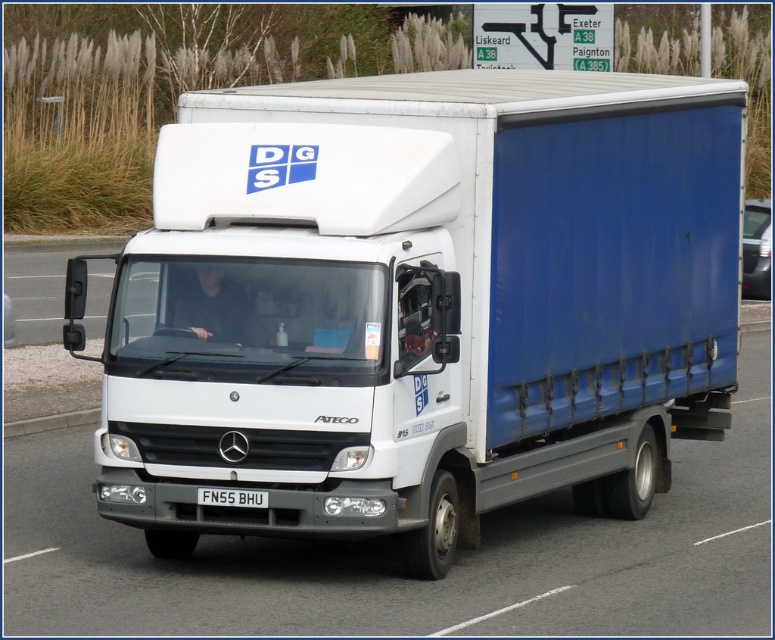
Is point (191, 138) less distant than point (233, 490)?

No.

Can you confirm if white matte truck at center is thinner than black metal license plate at center?

In fact, white matte truck at center might be wider than black metal license plate at center.

At what (x,y) coordinates should I click in order to perform the action: click on white matte truck at center. Please return your answer as a coordinate pair (x, y). The width and height of the screenshot is (775, 640). Looking at the image, I should click on (422, 304).